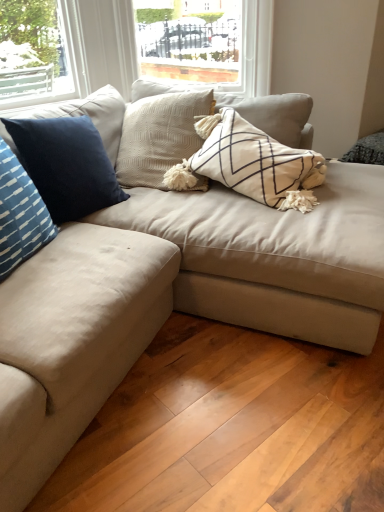
Question: Is blue striped pillow at left, arranged as the second pillow when viewed from the back, not within blue velvet pillow at left, the 2th pillow in the front-to-back sequence?

Choices:
 (A) yes
 (B) no

Answer: (A)

Question: Does blue striped pillow at left, arranged as the second pillow when viewed from the back, have a lesser width compared to blue velvet pillow at left, the 2th pillow in the front-to-back sequence?

Choices:
 (A) yes
 (B) no

Answer: (B)

Question: Is blue striped pillow at left, arranged as the second pillow when viewed from the back, smaller than blue velvet pillow at left, which ranks as the first pillow in back-to-front order?

Choices:
 (A) no
 (B) yes

Answer: (B)

Question: Does blue striped pillow at left, arranged as the second pillow when viewed from the back, have a lesser height compared to blue velvet pillow at left, the 2th pillow in the front-to-back sequence?

Choices:
 (A) no
 (B) yes

Answer: (B)

Question: Is blue striped pillow at left, arranged as the second pillow when viewed from the back, to the left of blue velvet pillow at left, which ranks as the first pillow in back-to-front order, from the viewer's perspective?

Choices:
 (A) yes
 (B) no

Answer: (A)

Question: Is the position of blue striped pillow at left, the 1th pillow viewed from the front, more distant than that of blue velvet pillow at left, the 2th pillow in the front-to-back sequence?

Choices:
 (A) no
 (B) yes

Answer: (A)

Question: Does blue velvet pillow at left, which ranks as the first pillow in back-to-front order, contain suede beige couch at center?

Choices:
 (A) yes
 (B) no

Answer: (B)

Question: Does blue velvet pillow at left, the 2th pillow in the front-to-back sequence, have a lesser height compared to suede beige couch at center?

Choices:
 (A) yes
 (B) no

Answer: (A)

Question: Is blue velvet pillow at left, the 2th pillow in the front-to-back sequence, not within suede beige couch at center?

Choices:
 (A) yes
 (B) no

Answer: (B)

Question: Is blue velvet pillow at left, the 2th pillow in the front-to-back sequence, thinner than suede beige couch at center?

Choices:
 (A) yes
 (B) no

Answer: (A)

Question: Is blue velvet pillow at left, which ranks as the first pillow in back-to-front order, positioned with its back to suede beige couch at center?

Choices:
 (A) no
 (B) yes

Answer: (B)

Question: Does blue velvet pillow at left, the 2th pillow in the front-to-back sequence, come in front of suede beige couch at center?

Choices:
 (A) yes
 (B) no

Answer: (B)

Question: Can blue striped pillow at left, the 1th pillow viewed from the front, be found inside suede beige couch at center?

Choices:
 (A) yes
 (B) no

Answer: (B)